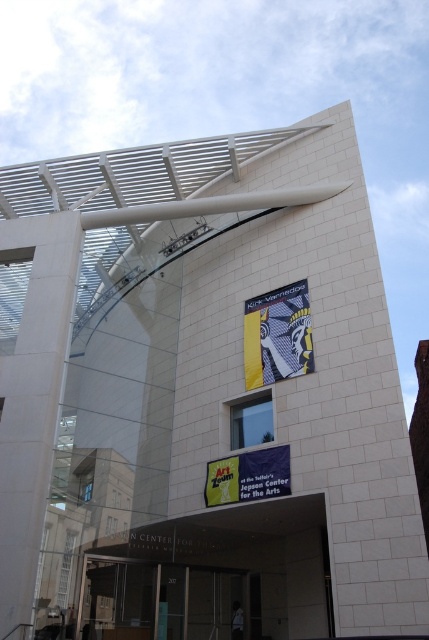
In the scene shown: Measure the distance from abstract patterned fabric at center to yellow fabric banner at center.

The distance of abstract patterned fabric at center from yellow fabric banner at center is 9.88 meters.

Is abstract patterned fabric at center thinner than yellow fabric banner at center?

In fact, abstract patterned fabric at center might be wider than yellow fabric banner at center.

Identify the location of abstract patterned fabric at center. The image size is (429, 640). (277, 336).

Looking at this image, who is shorter, white concrete pillar at left or yellow fabric banner at center?

yellow fabric banner at center is shorter.

Is white concrete pillar at left thinner than yellow fabric banner at center?

Incorrect, white concrete pillar at left's width is not less than yellow fabric banner at center's.

I want to click on white concrete pillar at left, so (x=30, y=392).

Can you confirm if white concrete pillar at left is bigger than abstract patterned fabric at center?

Yes.

Can you confirm if white concrete pillar at left is shorter than abstract patterned fabric at center?

Incorrect, white concrete pillar at left's height does not fall short of abstract patterned fabric at center's.

Describe the element at coordinates (30, 392) in the screenshot. I see `white concrete pillar at left` at that location.

The image size is (429, 640). Find the location of `white concrete pillar at left`. white concrete pillar at left is located at coordinates (30, 392).